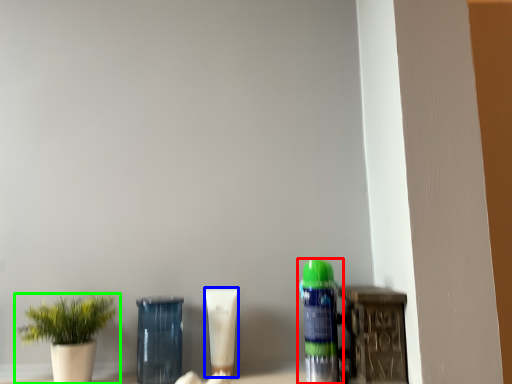
Question: Which object is positioned closest to bottle (highlighted by a red box)? Select from product (highlighted by a blue box) and houseplant (highlighted by a green box).

Choices:
 (A) product
 (B) houseplant

Answer: (A)